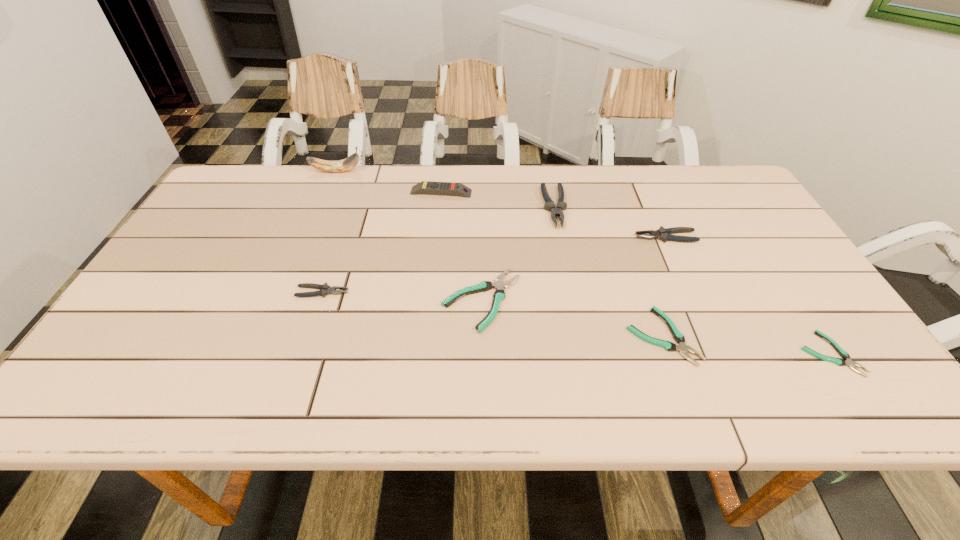
The image size is (960, 540). Identify the location of gray pliers that stands as the closest to the remote control. (549, 205).

Identify which teal pliers is located as the second nearest to the banana. Please provide its 2D coordinates. Your answer should be formatted as a tuple, i.e. [(x, y)], where the tuple contains the x and y coordinates of a point satisfying the conditions above.

[(678, 337)]

You are a GUI agent. You are given a task and a screenshot of the screen. Output one action in this format:
    pyautogui.click(x=<x>, y=<y>)
    Task: Click on the teal pliers that stands as the closest to the yellow remote control
    
    Given the screenshot: What is the action you would take?
    pyautogui.click(x=499, y=295)

Locate an element on the screen. The image size is (960, 540). vacant area in the image that satisfies the following two spatial constraints: 1. at the gripping part of the smallest gray pliers; 2. on the right side of the fifth tallest pliers is located at coordinates (308, 336).

Find the location of a particular element. The height and width of the screenshot is (540, 960). vacant space that satisfies the following two spatial constraints: 1. at the gripping part of the shortest object; 2. on the left side of the second gray pliers from right to left is located at coordinates (583, 354).

Where is `vacant space that satisfies the following two spatial constraints: 1. on the peel of the yellow banana; 2. on the left side of the second shortest pliers`? vacant space that satisfies the following two spatial constraints: 1. on the peel of the yellow banana; 2. on the left side of the second shortest pliers is located at coordinates (270, 336).

Image resolution: width=960 pixels, height=540 pixels. Find the location of `free location that satisfies the following two spatial constraints: 1. on the peel of the shortest object; 2. on the left side of the banana`. free location that satisfies the following two spatial constraints: 1. on the peel of the shortest object; 2. on the left side of the banana is located at coordinates (263, 354).

What are the coordinates of `vacant point that satisfies the following two spatial constraints: 1. on the back side of the rightmost pliers; 2. on the peel of the tallest object` in the screenshot? It's located at (710, 171).

Find the location of a particular element. vacant space that satisfies the following two spatial constraints: 1. on the peel of the banana; 2. on the back side of the rightmost teal pliers is located at coordinates (263, 354).

The height and width of the screenshot is (540, 960). In order to click on free location that satisfies the following two spatial constraints: 1. on the front side of the rightmost object; 2. on the right side of the remote control in this screenshot , I will do `click(424, 354)`.